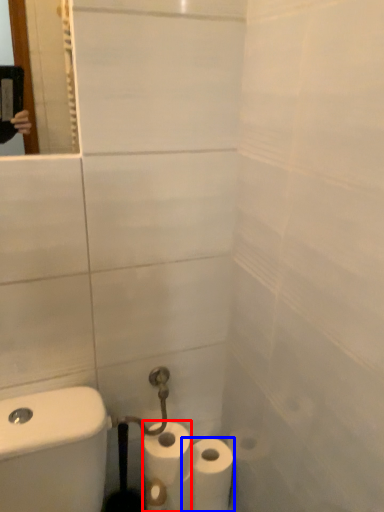
Question: Which point is further to the camera, toilet paper (highlighted by a red box) or toilet paper (highlighted by a blue box)?

Choices:
 (A) toilet paper
 (B) toilet paper

Answer: (B)